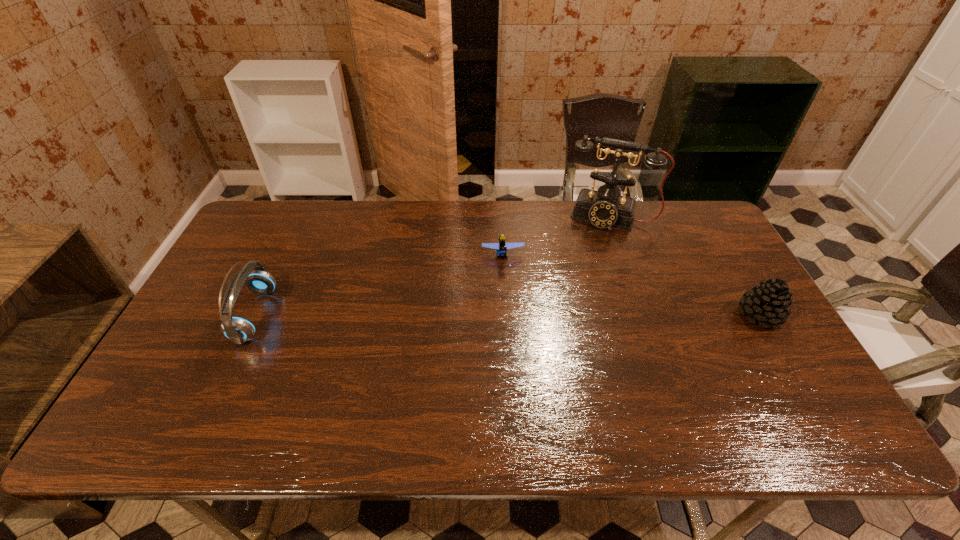
In the image, there is a desktop. At what (x,y) coordinates should I click in order to perform the action: click on free region at the near edge. Please return your answer as a coordinate pair (x, y). The image size is (960, 540). Looking at the image, I should click on (684, 375).

Locate an element on the screen. The width and height of the screenshot is (960, 540). vacant space at the right edge is located at coordinates (713, 308).

Identify the location of vacant space at the far left corner. (282, 231).

In the image, there is a desktop. At what (x,y) coordinates should I click in order to perform the action: click on vacant area at the near left corner. Please return your answer as a coordinate pair (x, y). Looking at the image, I should click on (160, 372).

In the image, there is a desktop. Identify the location of free region at the far right corner. The width and height of the screenshot is (960, 540). (691, 230).

Where is `unoccupied position between the leftmost object and the third object from left to right`? The height and width of the screenshot is (540, 960). unoccupied position between the leftmost object and the third object from left to right is located at coordinates pos(432,266).

I want to click on vacant area that lies between the headset and the third object from right to left, so click(379, 285).

I want to click on free spot between the third nearest object and the second tallest object, so click(x=379, y=285).

At what (x,y) coordinates should I click in order to perform the action: click on blank region between the tallest object and the headset. Please return your answer as a coordinate pair (x, y). Looking at the image, I should click on (432, 266).

You are a GUI agent. You are given a task and a screenshot of the screen. Output one action in this format:
    pyautogui.click(x=<x>, y=<y>)
    Task: Click on the vacant space in between the headset and the rightmost object
    Image resolution: width=960 pixels, height=540 pixels.
    Given the screenshot: What is the action you would take?
    pyautogui.click(x=508, y=315)